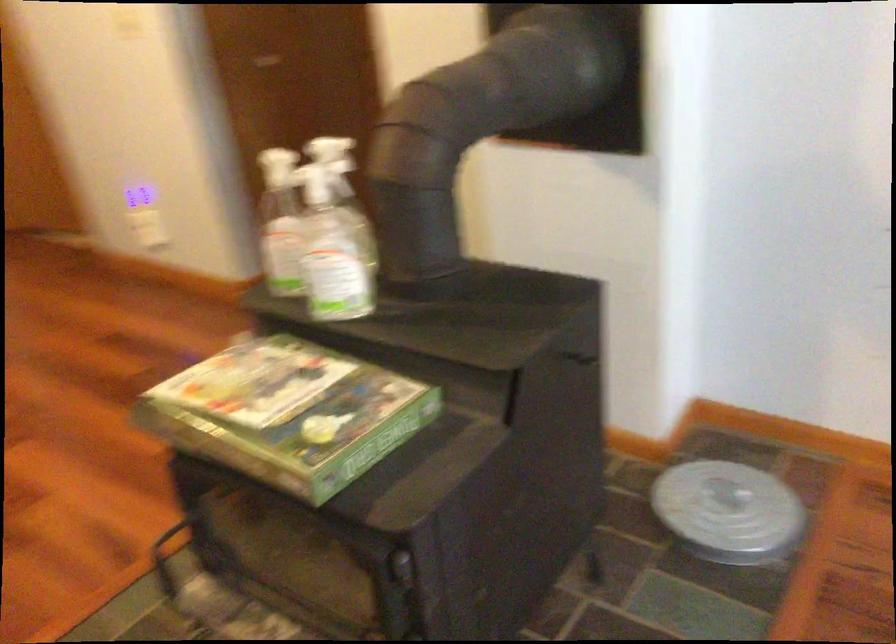
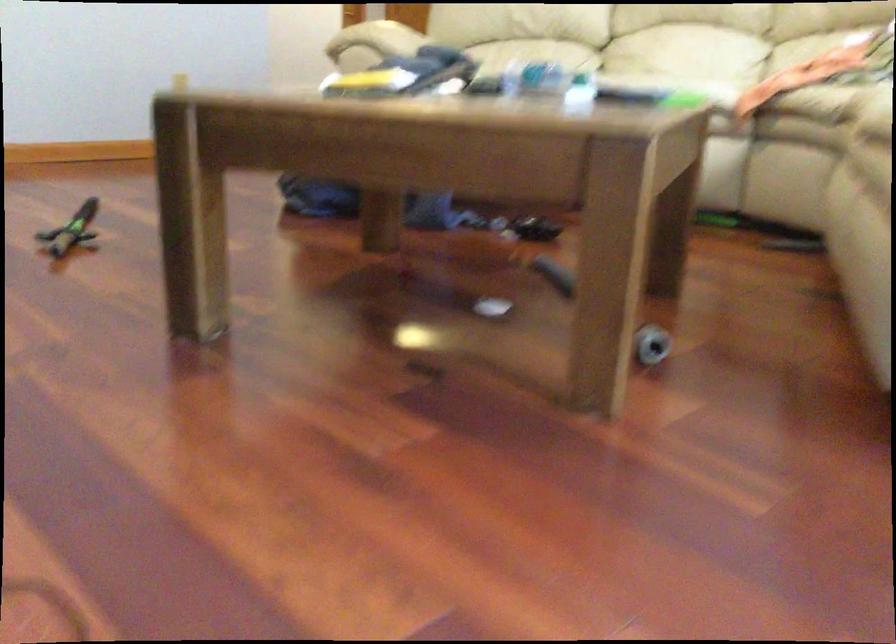
Question: I am providing you with two images of the same scene from different viewpoints. Which of the following objects are not visible in image2?

Choices:
 (A) small blue bucket
 (B) round metal lid
 (C) grey cylindrical object
 (D) green toy sword

Answer: (B)